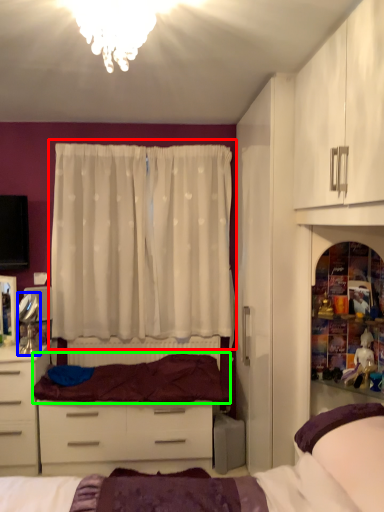
Question: Considering the real-world distances, which object is closest to curtain (highlighted by a red box)? mirror (highlighted by a blue box) or bedding (highlighted by a green box).

Choices:
 (A) mirror
 (B) bedding

Answer: (B)